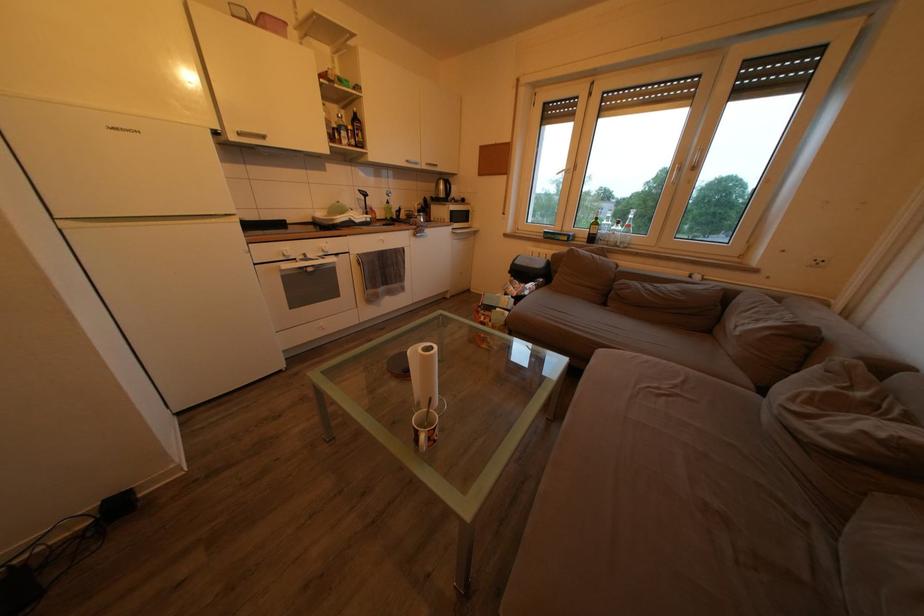
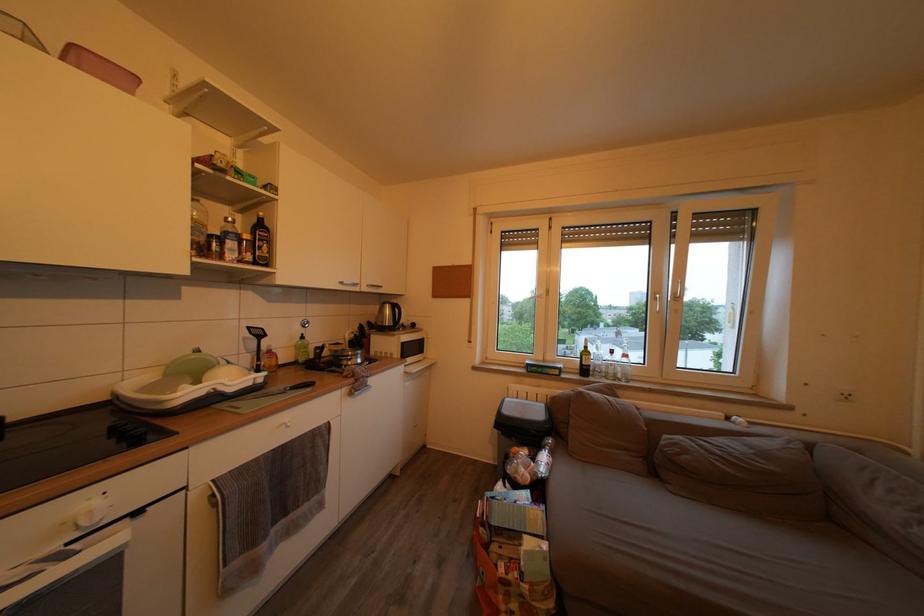
Locate, in the second image, the point that corresponds to point (365, 227) in the first image.

(238, 397)